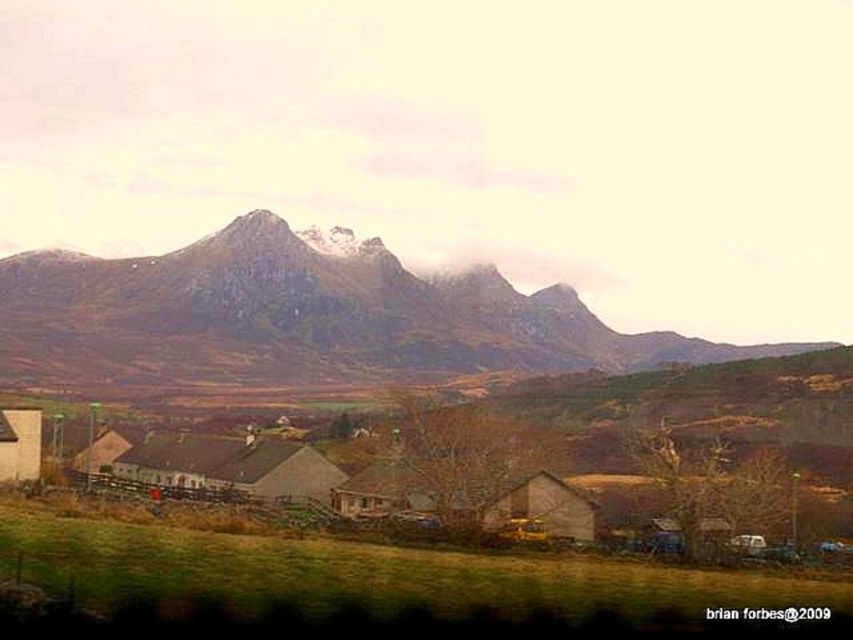
Question: From the image, what is the correct spatial relationship of matte gray barns at center in relation to brown wooden hut at lower left?

Choices:
 (A) above
 (B) below

Answer: (A)

Question: Which object is positioned farthest from the brown wooden house at center?

Choices:
 (A) matte gray barns at center
 (B) brown wooden hut at lower left
 (C) matte white hut at lower left
 (D) rocky gray mountain at upper center

Answer: (D)

Question: Which object appears farthest from the camera in this image?

Choices:
 (A) rocky gray mountain at upper center
 (B) matte white hut at lower left

Answer: (A)

Question: Can you confirm if rocky gray mountain at upper center is positioned to the left of matte gray barns at center?

Choices:
 (A) yes
 (B) no

Answer: (B)

Question: Which point is closer to the camera?

Choices:
 (A) matte gray barns at center
 (B) brown wooden house at center
 (C) rocky gray mountain at upper center

Answer: (A)

Question: Does matte gray barns at center have a greater width compared to brown wooden hut at lower left?

Choices:
 (A) no
 (B) yes

Answer: (B)